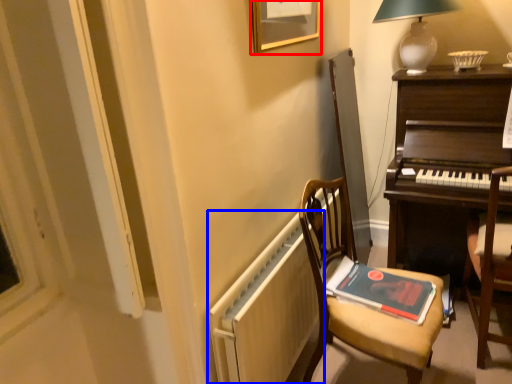
Question: Which of the following is the farthest to the observer, picture frame (highlighted by a red box) or radiator (highlighted by a blue box)?

Choices:
 (A) picture frame
 (B) radiator

Answer: (A)